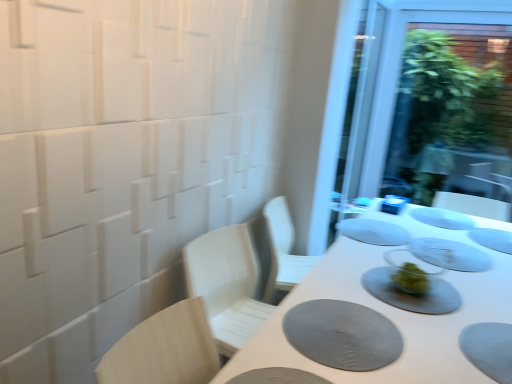
Find the location of a particular element. Image resolution: width=512 pixels, height=384 pixels. free space between clear glass plate at center, which is the 2th tableware from front to back, and matte white plate at center, acting as the 3th tableware starting from the back is located at coordinates (410, 241).